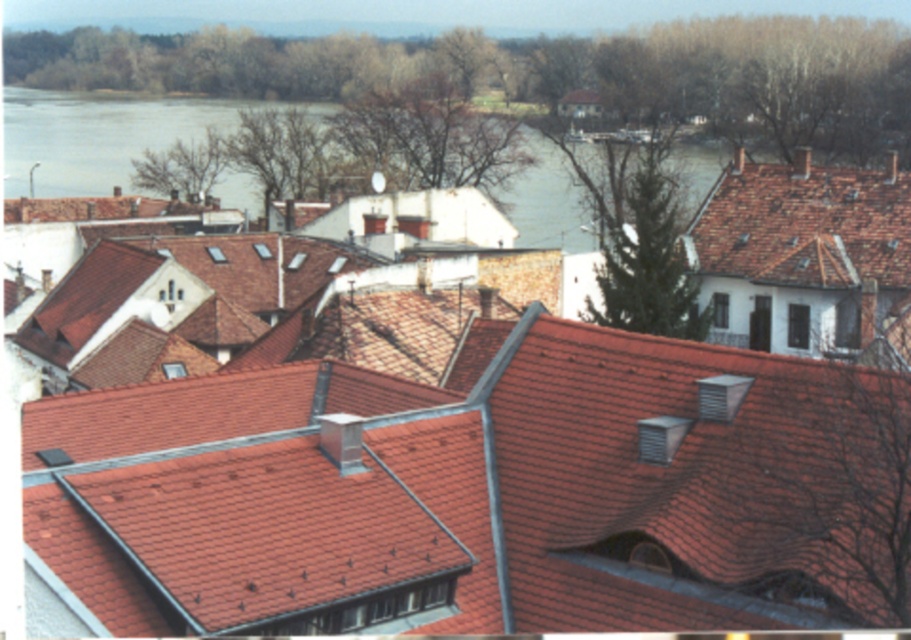
Which is behind, point (745, 528) or point (797, 257)?

Positioned behind is point (797, 257).

Is point (802, 609) positioned in front of point (896, 252)?

Yes.

This screenshot has height=640, width=911. Identify the location of red clay tiles at center. (477, 496).

Does point (333, 435) come closer to viewer compared to point (210, 99)?

Yes, it is.

Between red clay tiles at center and blue water at upper center, which one is positioned lower?

red clay tiles at center is below.

Is point (343, 464) in front of point (537, 141)?

Yes, it is in front of point (537, 141).

At what (x,y) coordinates should I click in order to perform the action: click on red clay tiles at center. Please return your answer as a coordinate pair (x, y). Looking at the image, I should click on tap(477, 496).

Does blue water at upper center have a greater height compared to red tile roof at upper right?

Yes.

Which is above, blue water at upper center or red tile roof at upper right?

Positioned higher is blue water at upper center.

Locate an element on the screen. The height and width of the screenshot is (640, 911). blue water at upper center is located at coordinates (96, 136).